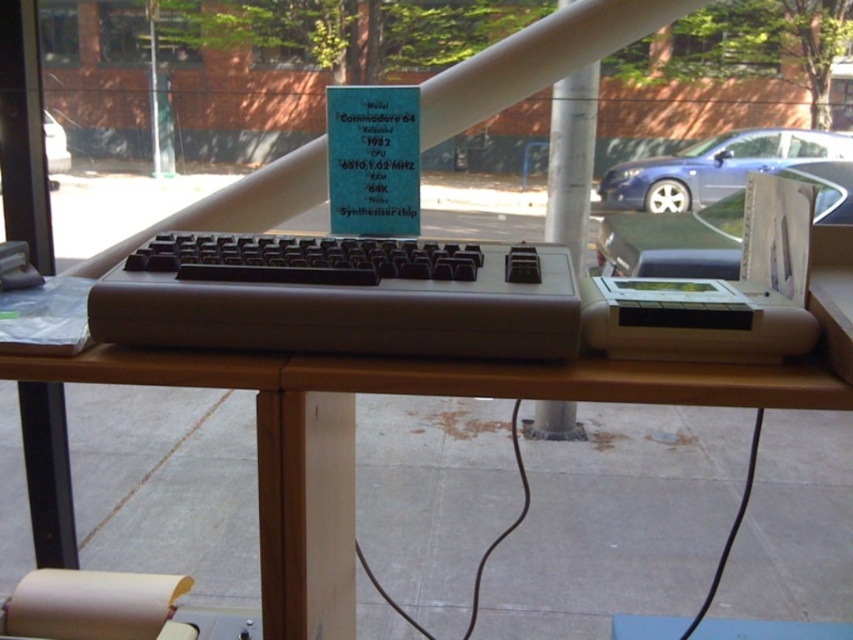
You are a museum visitor standing in front of the vintage computer exhibit. You see two points marked on the display case. The first point is at coordinates point (300, 278) and the second point is at point (573, 145). Which point is closer to you?

Point (300, 278) is in front of point (573, 145), so it is closer to you.

You are an interior designer planning to place a new decorative item between the brown wood table at center and the metallic blue car at left. Considering their sizes, which object should you place the item closer to for balance?

The brown wood table at center has a larger size compared to the metallic blue car at left, so placing the decorative item closer to the metallic blue car at left would create a balanced arrangement.

You are a tour guide leading a group through a technology museum. You need to move a large exhibit case that is 6 meters wide from the entrance to the display area. The path between the brown wood table at center and the metallic blue car at left is your only route. Can the exhibit case fit through this path?

The distance between the brown wood table at center and the metallic blue car at left is 5.23 meters. Since the exhibit case is 6 meters wide, it cannot fit through the path as the available space is narrower than the case.